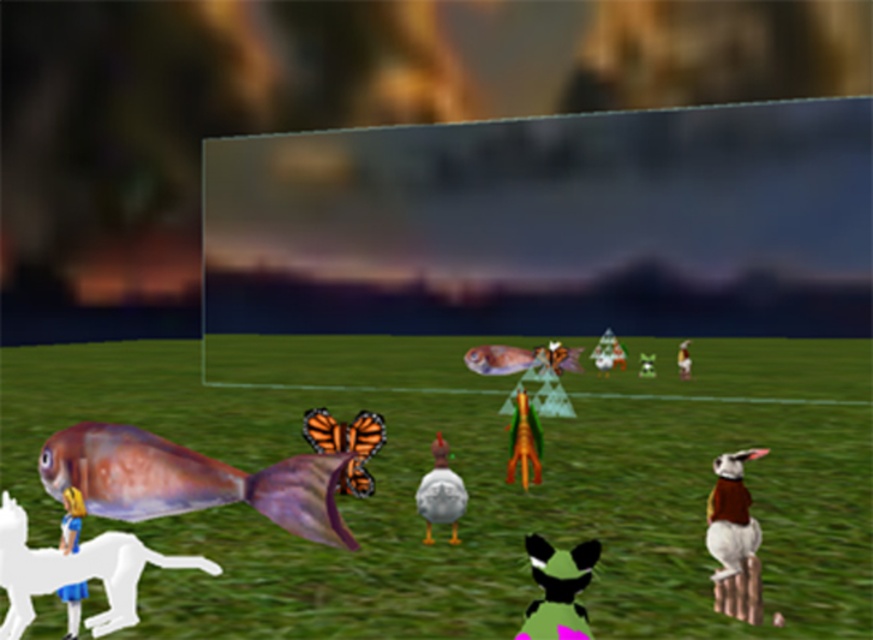
In order to click on shiny metallic fish at lower left in this screenshot , I will do `click(189, 481)`.

Which of these two, shiny metallic fish at lower left or white matte rabbit at right, stands shorter?

shiny metallic fish at lower left

At what (x,y) coordinates should I click in order to perform the action: click on shiny metallic fish at lower left. Please return your answer as a coordinate pair (x, y). Looking at the image, I should click on (189, 481).

Can you confirm if green matte toy at center is smaller than white matte rabbit at center?

No.

Which is more to the right, green matte toy at center or white matte rabbit at center?

From the viewer's perspective, white matte rabbit at center appears more on the right side.

Between point (535, 465) and point (686, 371), which one is positioned behind?

Point (686, 371)

Identify the location of green matte toy at center. The height and width of the screenshot is (640, 873). (524, 440).

Between shiny metallic fish at lower left and white matte duck at center, which one has less height?

With less height is shiny metallic fish at lower left.

Can you confirm if shiny metallic fish at lower left is thinner than white matte duck at center?

No.

Which is in front, point (81, 477) or point (456, 486)?

Point (81, 477) is more forward.

This screenshot has height=640, width=873. Find the location of `shiny metallic fish at lower left`. shiny metallic fish at lower left is located at coordinates (189, 481).